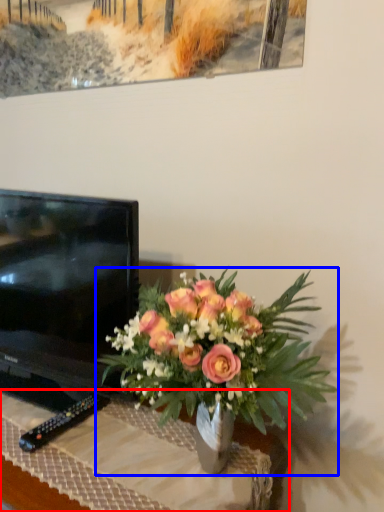
Question: Which object is closer to the camera taking this photo, desk (highlighted by a red box) or houseplant (highlighted by a blue box)?

Choices:
 (A) desk
 (B) houseplant

Answer: (B)